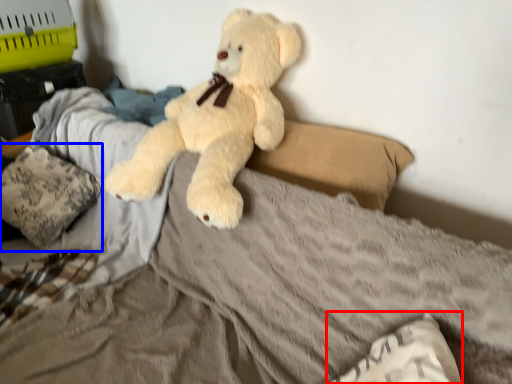
Question: Which of the following is the farthest to the observer, pillow (highlighted by a red box) or pillow (highlighted by a blue box)?

Choices:
 (A) pillow
 (B) pillow

Answer: (B)